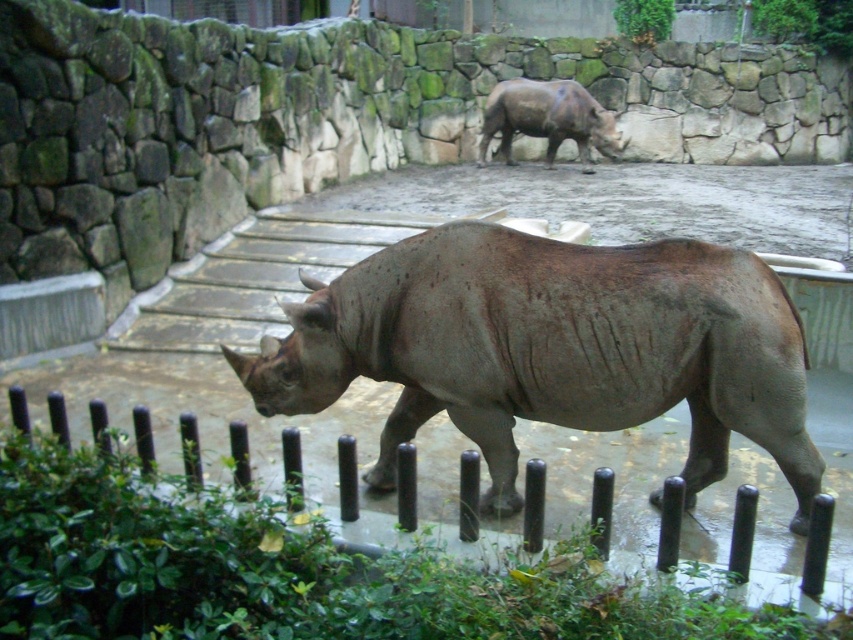
Can you confirm if black plastic fence at lower center is smaller than grayish-brown textured rhinoceros at upper center?

Correct, black plastic fence at lower center occupies less space than grayish-brown textured rhinoceros at upper center.

Which is in front, point (743, 534) or point (529, 99)?

Point (743, 534)

Where is `black plastic fence at lower center`? Image resolution: width=853 pixels, height=640 pixels. black plastic fence at lower center is located at coordinates (817, 548).

Can you confirm if grayish-brown textured rhinoceros at center is smaller than black plastic fence at lower center?

Incorrect, grayish-brown textured rhinoceros at center is not smaller in size than black plastic fence at lower center.

Describe the element at coordinates (552, 348) in the screenshot. I see `grayish-brown textured rhinoceros at center` at that location.

Which is behind, point (520, 307) or point (338, 538)?

Point (520, 307)

Find the location of a particular element. This screenshot has height=640, width=853. grayish-brown textured rhinoceros at center is located at coordinates point(552,348).

Which is in front, point (653, 344) or point (498, 145)?

Point (653, 344) is more forward.

Does grayish-brown textured rhinoceros at center have a lesser width compared to grayish-brown textured rhinoceros at upper center?

No.

Does point (546, 371) come in front of point (500, 144)?

That is True.

This screenshot has width=853, height=640. I want to click on grayish-brown textured rhinoceros at center, so click(552, 348).